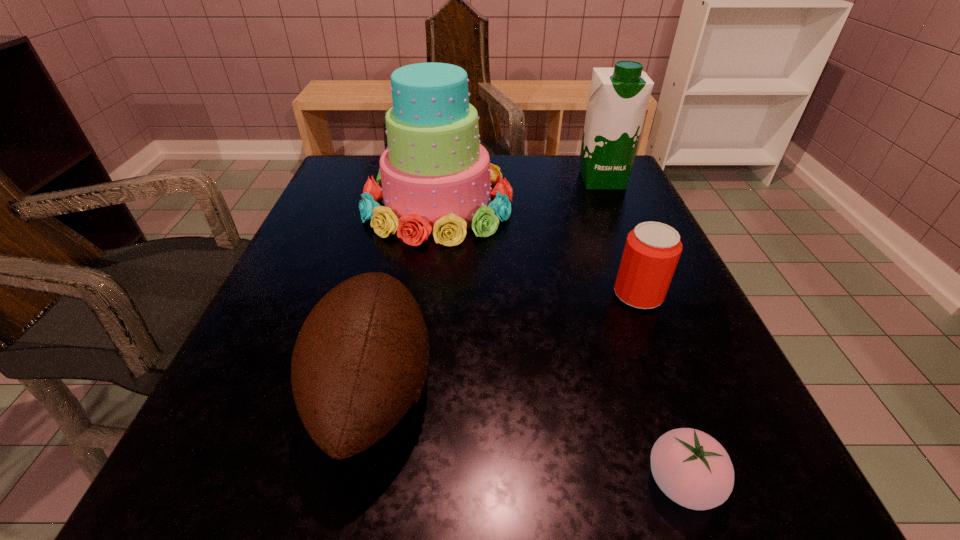
Locate an element on the screen. Image resolution: width=960 pixels, height=540 pixels. blank region between the beer can and the cake is located at coordinates (538, 250).

This screenshot has width=960, height=540. What are the coordinates of `free space between the shortest object and the football` in the screenshot? It's located at (528, 436).

Identify the location of empty location between the tomato and the cake. The image size is (960, 540). (560, 344).

Identify the location of free space between the soya milk and the tomato. The height and width of the screenshot is (540, 960). (642, 331).

Where is `free space between the third nearest object and the soya milk`? The height and width of the screenshot is (540, 960). free space between the third nearest object and the soya milk is located at coordinates (620, 237).

The width and height of the screenshot is (960, 540). I want to click on vacant point located between the beer can and the third tallest object, so click(506, 342).

This screenshot has height=540, width=960. I want to click on empty space that is in between the soya milk and the tomato, so click(642, 331).

Image resolution: width=960 pixels, height=540 pixels. Find the location of `free space between the third tallest object and the shortest object`. free space between the third tallest object and the shortest object is located at coordinates (528, 436).

What are the coordinates of `vacant region between the football and the soya milk` in the screenshot? It's located at (488, 285).

Locate an element on the screen. blank region between the shortest object and the soya milk is located at coordinates (642, 331).